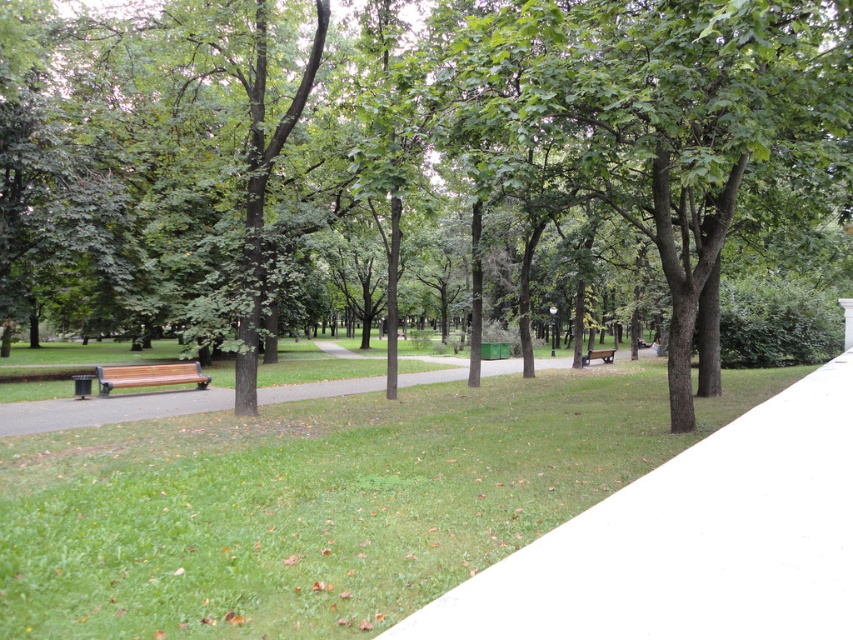
Which of these two, green leafy tree at center or wooden bench at left, stands shorter?

wooden bench at left

Which is behind, point (567, 193) or point (154, 364)?

The point (154, 364) is behind.

The width and height of the screenshot is (853, 640). Identify the location of green leafy tree at center. (404, 156).

Consider the image. Is green leafy tree at center to the right of white smooth pavement at center from the viewer's perspective?

No, green leafy tree at center is not to the right of white smooth pavement at center.

The width and height of the screenshot is (853, 640). What do you see at coordinates (404, 156) in the screenshot?
I see `green leafy tree at center` at bounding box center [404, 156].

Where is `green leafy tree at center`? Image resolution: width=853 pixels, height=640 pixels. green leafy tree at center is located at coordinates (404, 156).

Is green leafy tree at center behind wooden bench at center?

No, it is not.

Is point (604, 275) behind point (589, 349)?

No, (604, 275) is in front of (589, 349).

Image resolution: width=853 pixels, height=640 pixels. In order to click on green leafy tree at center in this screenshot , I will do `click(404, 156)`.